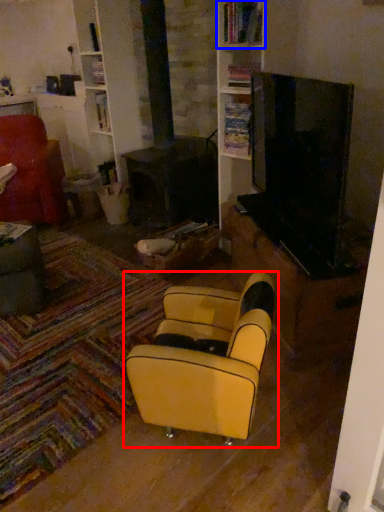
Question: Which object appears closest to the camera in this image, chair (highlighted by a red box) or shelf (highlighted by a blue box)?

Choices:
 (A) chair
 (B) shelf

Answer: (A)